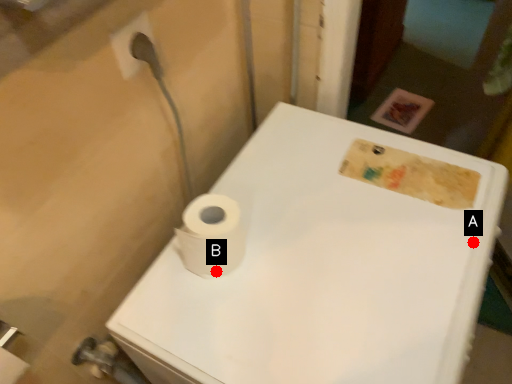
Question: Two points are circled on the image, labeled by A and B beside each circle. Which point is farther from the camera taking this photo?

Choices:
 (A) A is further
 (B) B is further

Answer: (A)